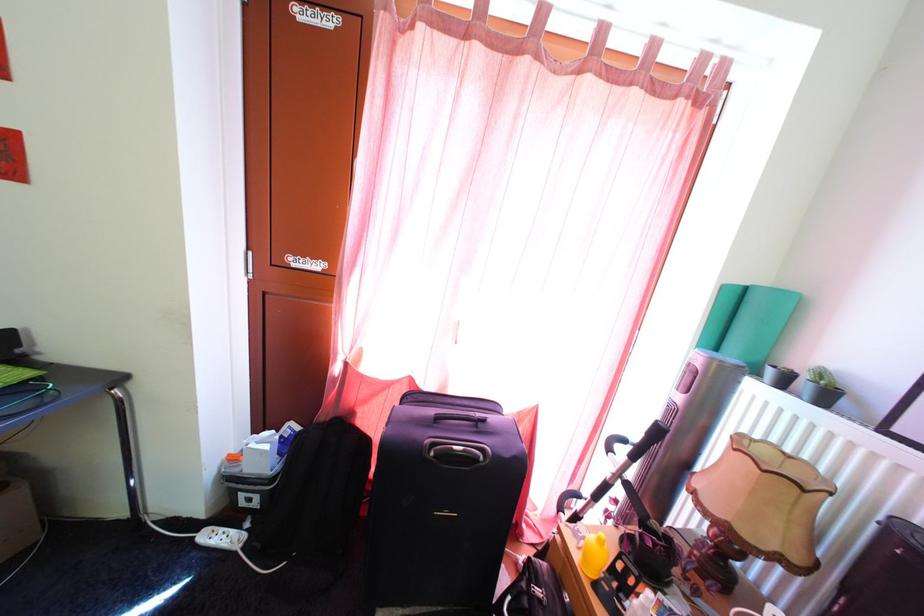
What do you see at coordinates (626, 458) in the screenshot? I see `a black walker handle` at bounding box center [626, 458].